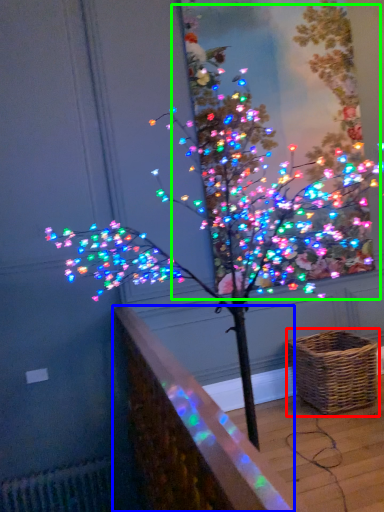
Question: Based on their relative distances, which object is nearer to picnic basket (highlighted by a red box)? Choose from ledge (highlighted by a blue box) and christmas tree (highlighted by a green box).

Choices:
 (A) ledge
 (B) christmas tree

Answer: (B)